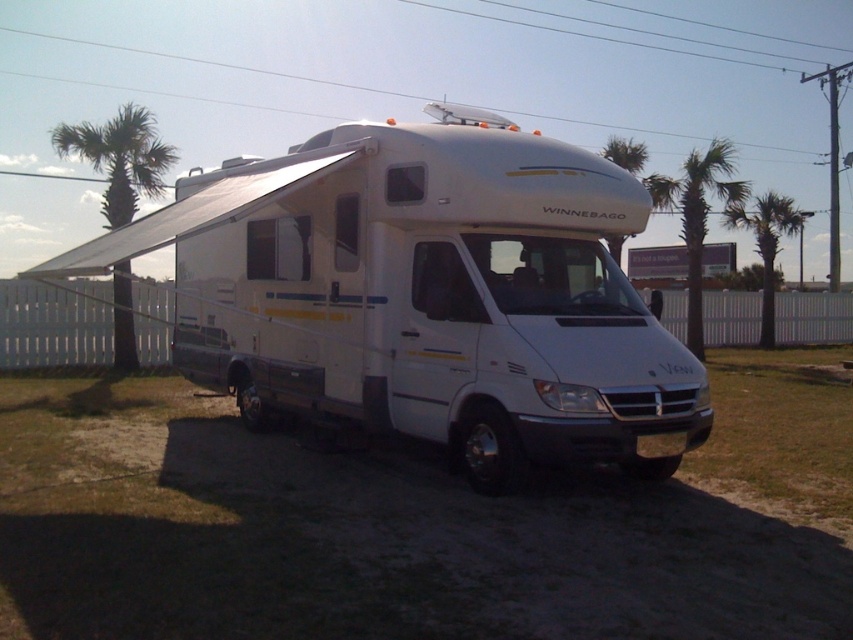
You are standing at a distance and want to take a photo of the white matte recreational vehicle at center. If you are exactly 21.26 feet away from it, will you be able to capture the entire vehicle in your camera frame without moving closer or farther?

Yes, since you are exactly 21.26 feet away from the white matte recreational vehicle at center, which is the required distance to capture the entire vehicle in the camera frame without needing to adjust your position.